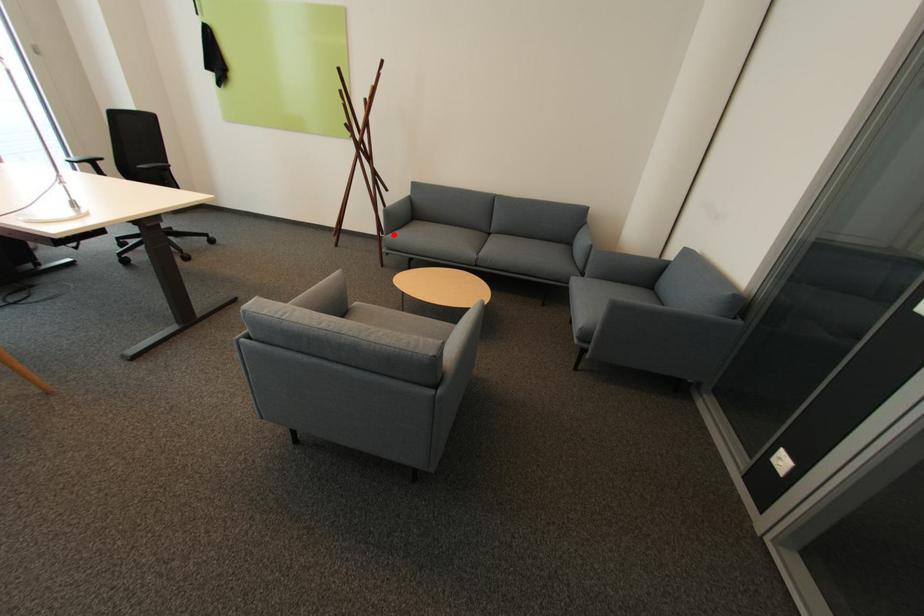
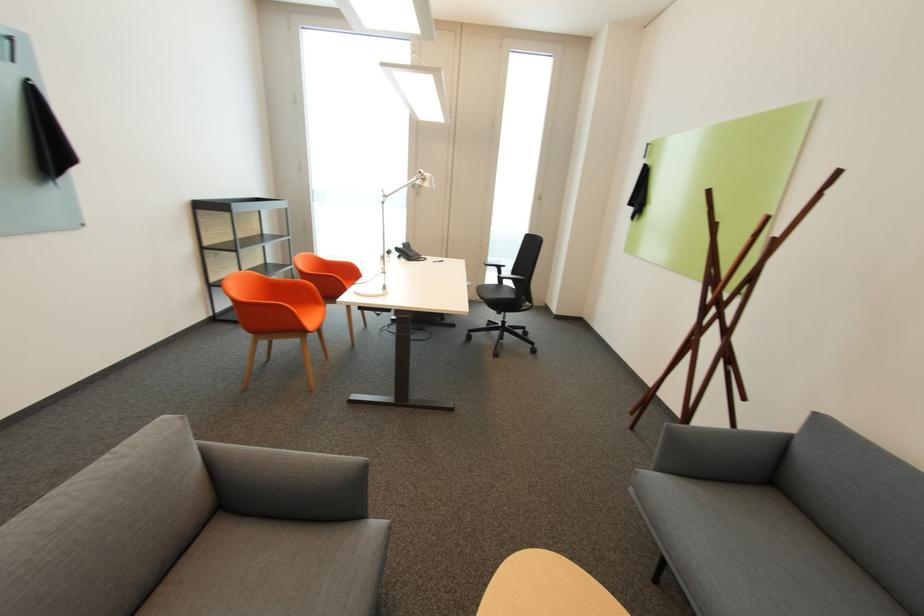
Question: I am providing you with two images of the same scene from different viewpoints. In image1, a red point is highlighted. Considering the same 3D point in image2, which of the following is correct?

Choices:
 (A) It is closer
 (B) It is farther

Answer: (A)